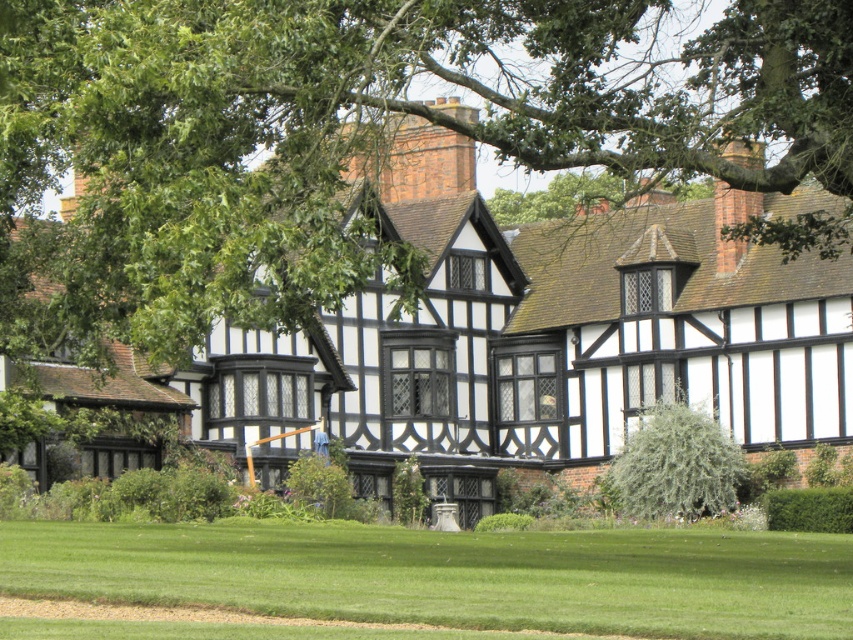
Does green leafy tree at upper center appear on the right side of green fuzzy bush at center?

In fact, green leafy tree at upper center is to the left of green fuzzy bush at center.

Consider the image. Who is more forward, (167, 19) or (688, 496)?

Positioned in front is point (167, 19).

Identify the location of green leafy tree at upper center. This screenshot has width=853, height=640. (363, 140).

Between green leafy tree at upper center and green grass at lower center, which one is positioned lower?

green grass at lower center is below.

Which is behind, point (373, 225) or point (659, 609)?

The point (373, 225) is more distant.

This screenshot has width=853, height=640. In order to click on green leafy tree at upper center in this screenshot , I will do `click(363, 140)`.

Locate an element on the screen. Image resolution: width=853 pixels, height=640 pixels. green leafy tree at upper center is located at coordinates (363, 140).

Measure the distance between point (676, 573) and camera.

They are 55.48 meters apart.

In the scene shown: Does green grass at lower center have a lesser height compared to green fuzzy bush at center?

Incorrect, green grass at lower center's height does not fall short of green fuzzy bush at center's.

Is point (318, 572) closer to viewer compared to point (698, 500)?

Yes.

This screenshot has width=853, height=640. In order to click on green grass at lower center in this screenshot , I will do `click(451, 573)`.